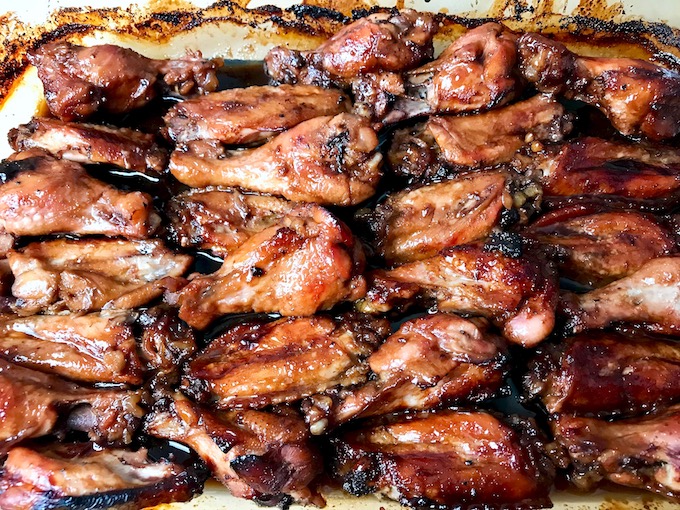
This screenshot has height=510, width=680. Identify the location of the front side of dish. (222, 499).